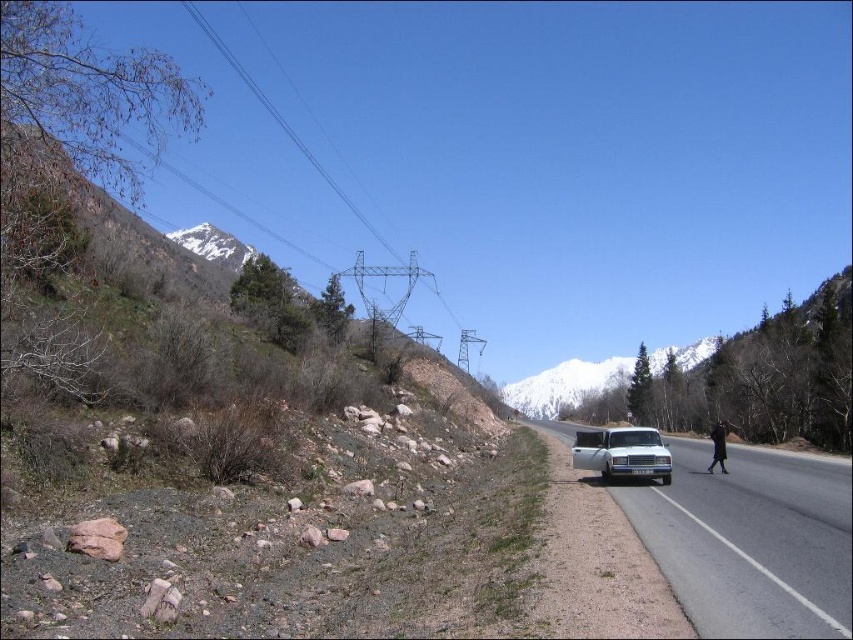
Question: Among these objects, which one is farthest from the camera?

Choices:
 (A) dark green coat at center-right
 (B) white glossy car at center

Answer: (A)

Question: Among these objects, which one is farthest from the camera?

Choices:
 (A) white glossy car at center
 (B) dark green coat at center-right
 (C) white glossy sedan at center

Answer: (B)

Question: Which is nearer to the white glossy car at center?

Choices:
 (A) rustic brown dirt at upper left
 (B) metallic wire at upper center

Answer: (A)

Question: In this image, where is rustic brown dirt at upper left located relative to white glossy car at center?

Choices:
 (A) below
 (B) above

Answer: (B)

Question: Is rustic brown dirt at upper left to the left of metallic wire at upper center from the viewer's perspective?

Choices:
 (A) yes
 (B) no

Answer: (B)

Question: Does rustic brown dirt at upper left have a larger size compared to white glossy sedan at center?

Choices:
 (A) no
 (B) yes

Answer: (B)